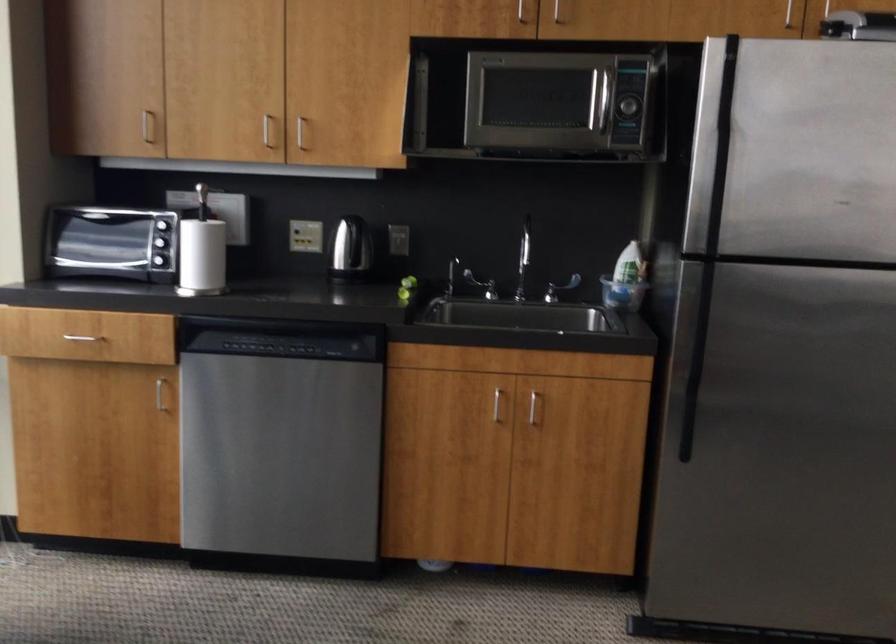
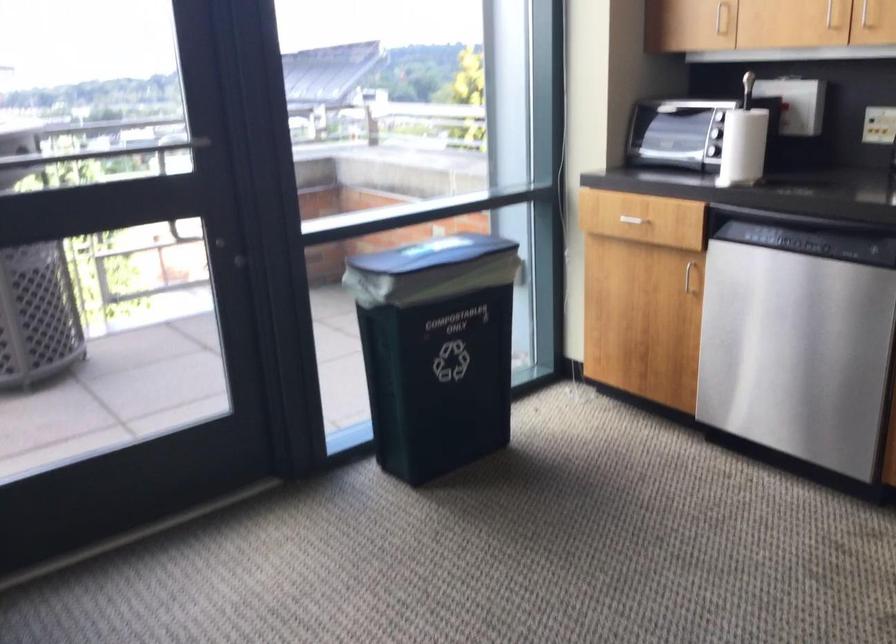
Question: The camera is either moving clockwise (left) or counter-clockwise (right) around the object. The first image is from the beginning of the video and the second image is from the end. Is the camera moving left or right when shooting the video?

Choices:
 (A) Left
 (B) Right

Answer: (B)